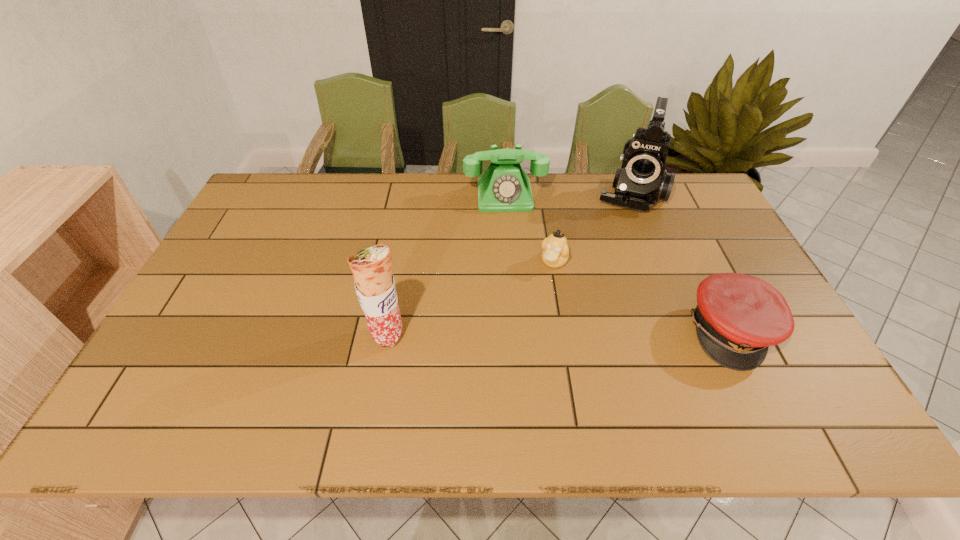
Image resolution: width=960 pixels, height=540 pixels. In order to click on free space on the desktop that is between the leftmost object and the cap and is positioned on the dial of the telephone in this screenshot , I will do `click(518, 334)`.

This screenshot has height=540, width=960. Find the location of `vacant spot on the desktop that is between the leftmost object and the cap and is positioned on the face of the duckling`. vacant spot on the desktop that is between the leftmost object and the cap and is positioned on the face of the duckling is located at coordinates pyautogui.click(x=512, y=334).

I want to click on vacant space on the desktop that is between the burrito and the cap and is positioned on the lens mount of the camcorder, so click(596, 333).